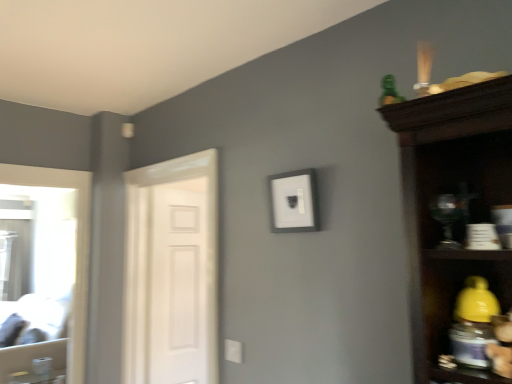
Find the location of `white matte door at left`. white matte door at left is located at coordinates (178, 282).

This screenshot has height=384, width=512. What do you see at coordinates (172, 271) in the screenshot?
I see `white painted wood door at left` at bounding box center [172, 271].

The image size is (512, 384). In order to click on white matte door at left in this screenshot , I will do `click(178, 282)`.

Considering the relative sizes of white matte picture frame at center and white painted wood door at left in the image provided, is white matte picture frame at center thinner than white painted wood door at left?

Indeed, white matte picture frame at center has a lesser width compared to white painted wood door at left.

Is white matte picture frame at center spatially inside white painted wood door at left, or outside of it?

white matte picture frame at center lies outside white painted wood door at left.

Could you tell me if white matte picture frame at center is turned towards white painted wood door at left?

No, white matte picture frame at center is not aimed at white painted wood door at left.

Are green plastic toy at upper right and white matte picture frame at center far apart?

green plastic toy at upper right is actually quite close to white matte picture frame at center.

Is green plastic toy at upper right inside the boundaries of white matte picture frame at center, or outside?

green plastic toy at upper right exists outside the volume of white matte picture frame at center.

From a real-world perspective, which is physically above, green plastic toy at upper right or white matte picture frame at center?

green plastic toy at upper right, from a real-world perspective.

Considering the positions of objects green plastic toy at upper right and white matte picture frame at center in the image provided, who is more to the right, green plastic toy at upper right or white matte picture frame at center?

green plastic toy at upper right.

Between white matte door at left and white matte picture frame at center, which one is positioned in front?

white matte picture frame at center is in front.

Which object is wider, white matte door at left or white matte picture frame at center?

Wider between the two is white matte door at left.

Is point (180, 300) farther from viewer compared to point (271, 190)?

That is True.

You are a GUI agent. You are given a task and a screenshot of the screen. Output one action in this format:
    pyautogui.click(x=<x>, y=<y>)
    Task: Click on the picture frame located above the white matte door at left (from the image's perspective)
    Image resolution: width=512 pixels, height=384 pixels.
    Given the screenshot: What is the action you would take?
    pyautogui.click(x=293, y=201)

How many degrees apart are the facing directions of white painted wood door at left and green plastic toy at upper right?

3.94 degrees.

Can you confirm if white painted wood door at left is positioned to the right of green plastic toy at upper right?

In fact, white painted wood door at left is to the left of green plastic toy at upper right.

Is white painted wood door at left closer to the viewer compared to green plastic toy at upper right?

No.

From a real-world perspective, which is physically above, white painted wood door at left or green plastic toy at upper right?

green plastic toy at upper right.

Based on the photo, are white matte door at left and green plastic toy at upper right making contact?

No, white matte door at left is not beside green plastic toy at upper right.

Does white matte door at left have a smaller size compared to green plastic toy at upper right?

No, white matte door at left is not smaller than green plastic toy at upper right.

Is white matte door at left taller or shorter than green plastic toy at upper right?

white matte door at left is taller than green plastic toy at upper right.

Could you tell me if white matte door at left is turned towards green plastic toy at upper right?

Yes.

Is white matte picture frame at center in front of white matte door at left?

Yes, the depth of white matte picture frame at center is less than that of white matte door at left.

From the picture: Could white matte door at left be considered to be inside white matte picture frame at center?

Result: Definitely not — white matte door at left is not inside white matte picture frame at center.

From the image's perspective, does white matte picture frame at center appear lower than white matte door at left?

Incorrect, from the image's perspective, white matte picture frame at center is higher than white matte door at left.

In the image, is white matte picture frame at center on the left side or the right side of white matte door at left?

Based on their positions, white matte picture frame at center is located to the right of white matte door at left.

Which is in front, point (305, 174) or point (387, 95)?

Positioned in front is point (387, 95).

Between white matte picture frame at center and green plastic toy at upper right, which one has less height?

With less height is green plastic toy at upper right.

From the image's perspective, which one is positioned lower, white matte picture frame at center or green plastic toy at upper right?

white matte picture frame at center is shown below in the image.

Locate an element on the screen. The height and width of the screenshot is (384, 512). door that appears on the left of white matte picture frame at center is located at coordinates (172, 271).

This screenshot has height=384, width=512. In order to click on picture frame lying below the green plastic toy at upper right (from the image's perspective) in this screenshot , I will do `click(293, 201)`.

Based on their spatial positions, is white painted wood door at left or white matte picture frame at center closer to green plastic toy at upper right?

white matte picture frame at center.

From the image, which object appears to be nearer to white matte door at left, white painted wood door at left or green plastic toy at upper right?

Based on the image, white painted wood door at left appears to be nearer to white matte door at left.

Which object lies nearer to the anchor point white matte picture frame at center, white painted wood door at left or white matte door at left?

white painted wood door at left.

From the image, which object appears to be farther from green plastic toy at upper right, white matte picture frame at center or white painted wood door at left?

Among the two, white painted wood door at left is located further to green plastic toy at upper right.

Considering their positions, is white matte door at left positioned closer to white matte picture frame at center than white painted wood door at left?

white painted wood door at left lies closer to white matte picture frame at center than the other object.

Which object lies nearer to the anchor point white matte door at left, green plastic toy at upper right or white painted wood door at left?

Among the two, white painted wood door at left is located nearer to white matte door at left.

Which object lies nearer to the anchor point white painted wood door at left, white matte door at left or white matte picture frame at center?

The object closer to white painted wood door at left is white matte door at left.

Which object lies nearer to the anchor point white matte door at left, green plastic toy at upper right or white matte picture frame at center?

Among the two, white matte picture frame at center is located nearer to white matte door at left.

The image size is (512, 384). I want to click on door located between white matte picture frame at center and white matte door at left in the depth direction, so click(172, 271).

Image resolution: width=512 pixels, height=384 pixels. Identify the location of picture frame between green plastic toy at upper right and white painted wood door at left along the z-axis. (293, 201).

Image resolution: width=512 pixels, height=384 pixels. I want to click on door located between green plastic toy at upper right and white matte door at left in the depth direction, so click(x=172, y=271).

This screenshot has height=384, width=512. I want to click on picture frame between green plastic toy at upper right and white matte door at left in the front-back direction, so click(x=293, y=201).